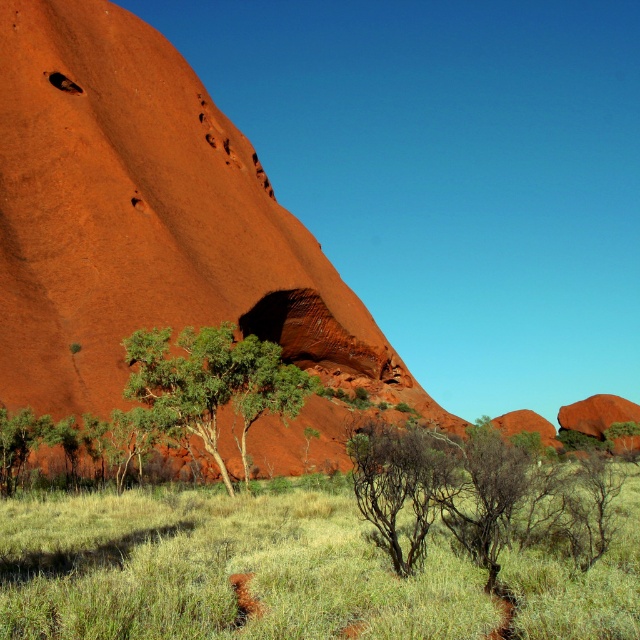
Is green leafy tree at center closer to the viewer compared to brown/dry shrub at center?

No.

Find the location of a particular element. This screenshot has width=640, height=640. green leafy tree at center is located at coordinates (212, 381).

Does green grass at lower center appear under green leafy tree at center?

Yes, green grass at lower center is below green leafy tree at center.

Where is `green grass at lower center`? The width and height of the screenshot is (640, 640). green grass at lower center is located at coordinates (221, 570).

Measure the distance between point (384, 600) and camera.

Point (384, 600) and camera are 17.79 meters apart.

Is green grass at lower center taller than green leafy shrub at center?

No, green grass at lower center is not taller than green leafy shrub at center.

This screenshot has width=640, height=640. Find the location of `green grass at lower center`. green grass at lower center is located at coordinates 221,570.

You are a GUI agent. You are given a task and a screenshot of the screen. Output one action in this format:
    pyautogui.click(x=<x>, y=<y>)
    Task: Click on the green grass at lower center
    The height and width of the screenshot is (640, 640).
    Given the screenshot: What is the action you would take?
    pyautogui.click(x=221, y=570)